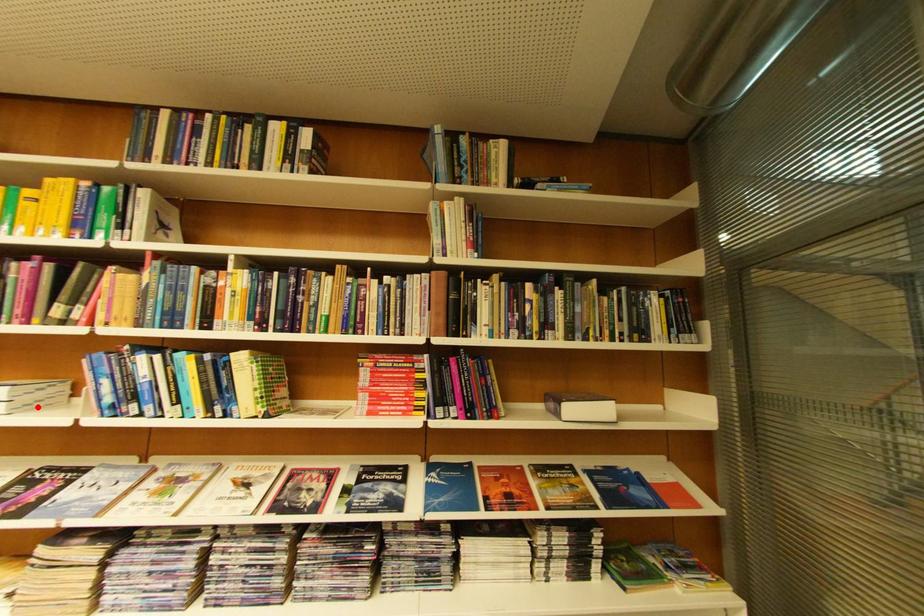
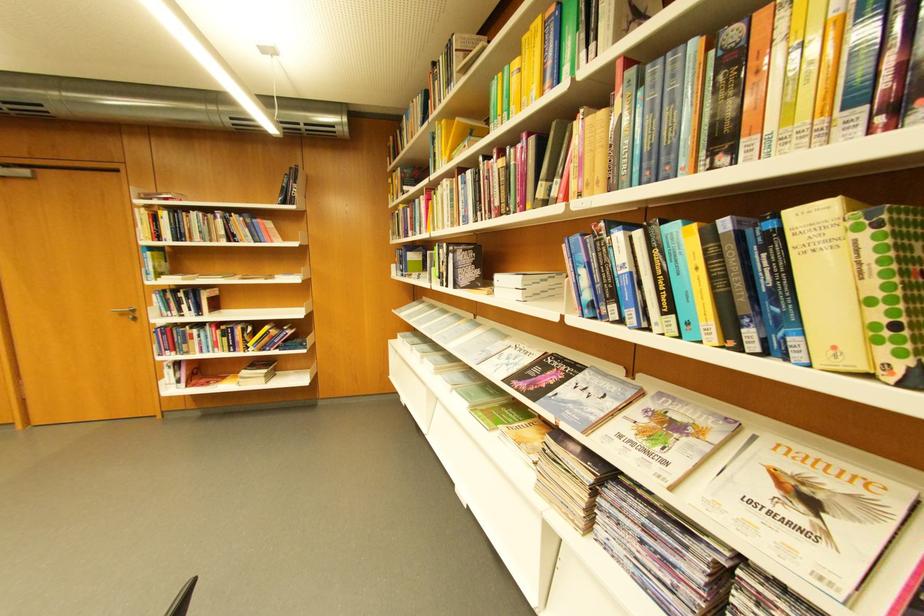
Question: A red point is marked in image1. In image2, is the corresponding 3D point closer to the camera or farther? Reply with the corresponding letter.

Choices:
 (A) The corresponding 3D point is closer.
 (B) The corresponding 3D point is farther.

Answer: (B)